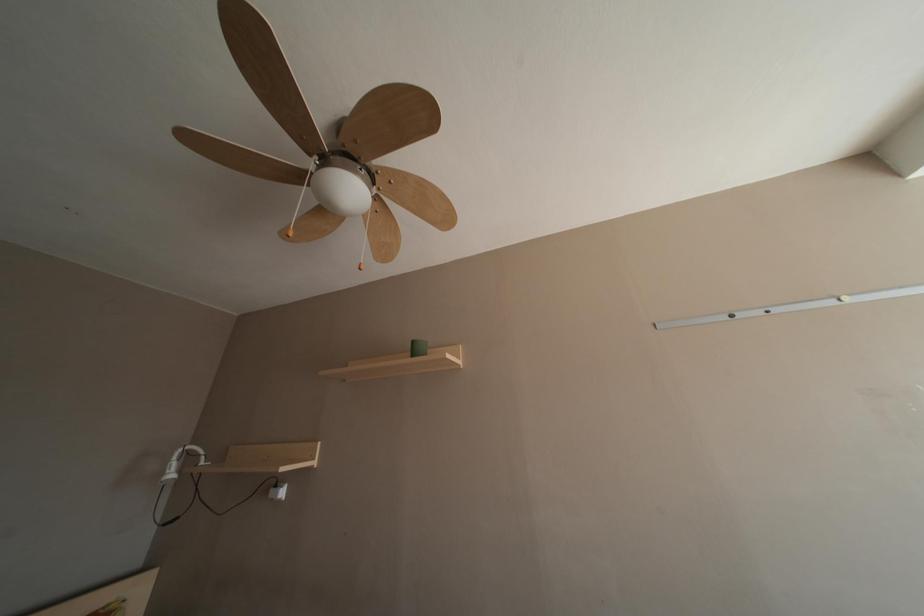
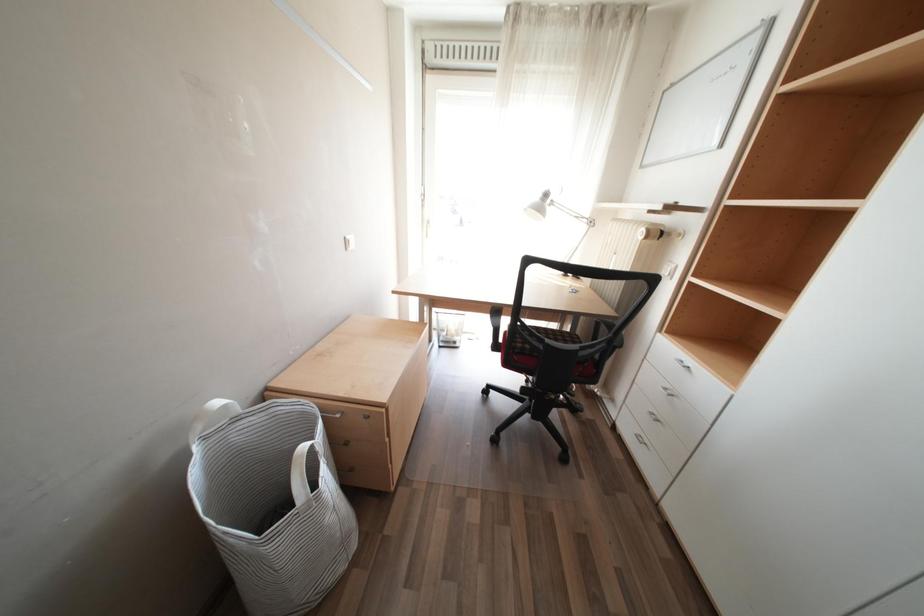
Question: The camera is either moving clockwise (left) or counter-clockwise (right) around the object. The first image is from the beginning of the video and the second image is from the end. Is the camera moving left or right when shooting the video?

Choices:
 (A) Left
 (B) Right

Answer: (A)